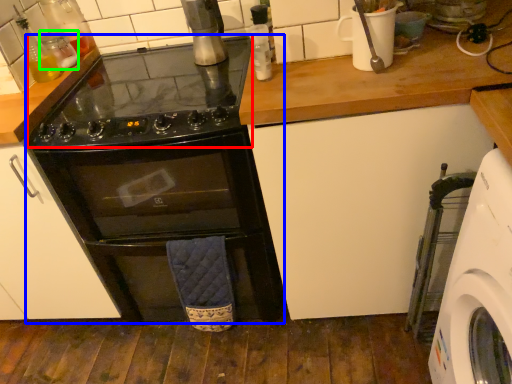
Question: Considering the real-world distances, which object is closest to gas stove (highlighted by a red box)? oven (highlighted by a blue box) or bottle (highlighted by a green box).

Choices:
 (A) oven
 (B) bottle

Answer: (A)